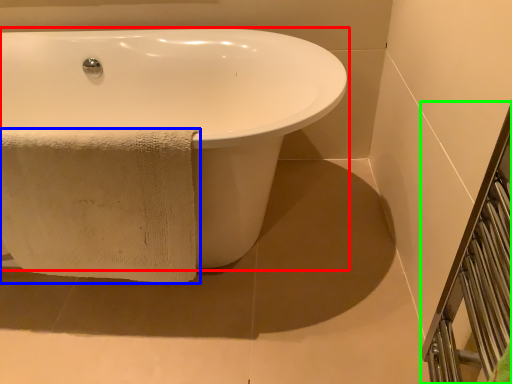
Question: Considering the real-world distances, which object is farthest from bathtub (highlighted by a red box)? towel (highlighted by a blue box) or balustrade (highlighted by a green box)?

Choices:
 (A) towel
 (B) balustrade

Answer: (B)